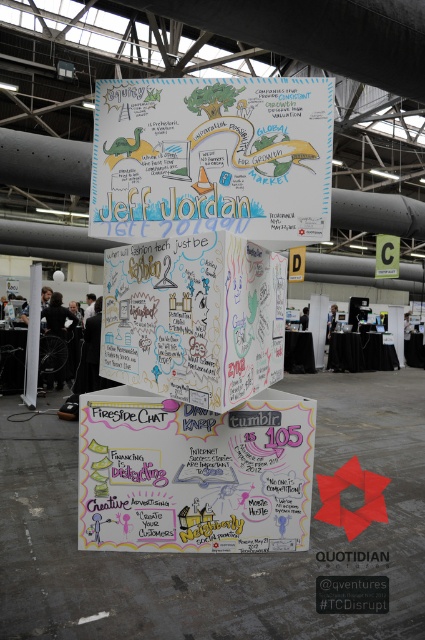
Question: Is white paperboard at center positioned in front of white cardboard box at center?

Choices:
 (A) no
 (B) yes

Answer: (A)

Question: Which object appears farthest from the camera in this image?

Choices:
 (A) white chalkboard at center
 (B) white cardboard box at center
 (C) white paperboard at center

Answer: (C)

Question: Is white paperboard at center further to camera compared to white chalkboard at center?

Choices:
 (A) yes
 (B) no

Answer: (A)

Question: In this image, where is white chalkboard at center located relative to white cardboard box at center?

Choices:
 (A) right
 (B) left

Answer: (A)

Question: Which point appears closest to the camera in this image?

Choices:
 (A) (102, 524)
 (B) (142, 330)

Answer: (A)

Question: Which point appears closest to the camera in this image?

Choices:
 (A) (193, 161)
 (B) (192, 387)

Answer: (B)